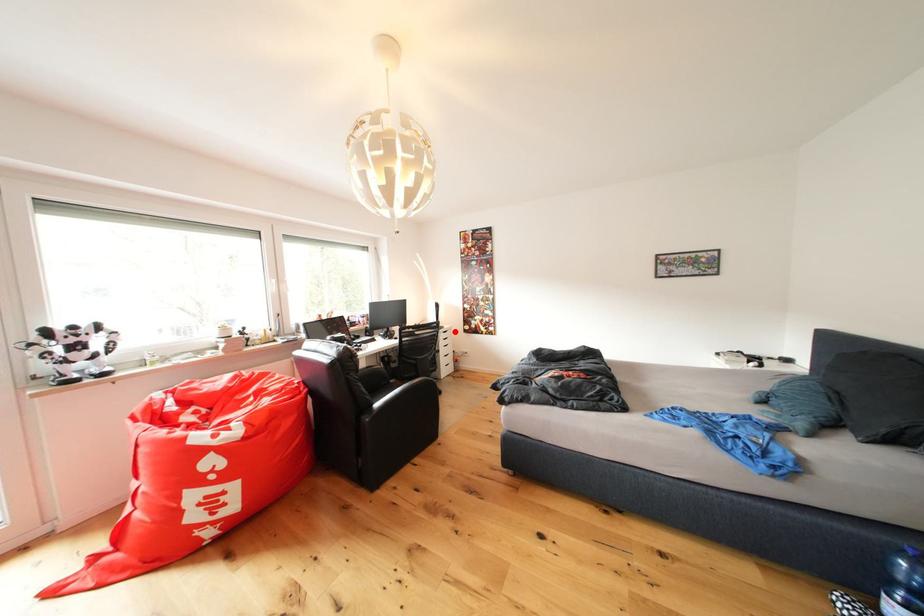
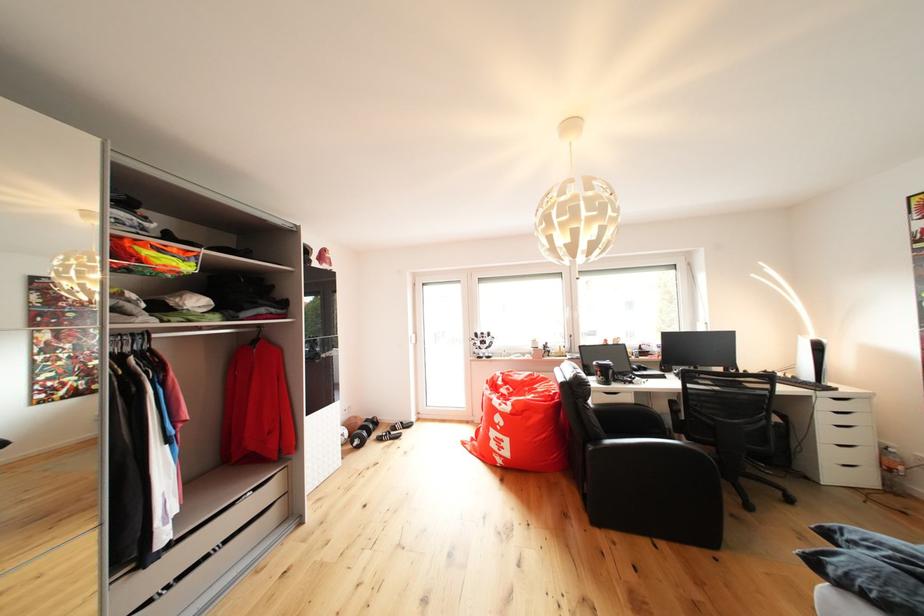
The point at the highlighted location is marked in the first image. Where is the corresponding point in the second image?

(855, 395)